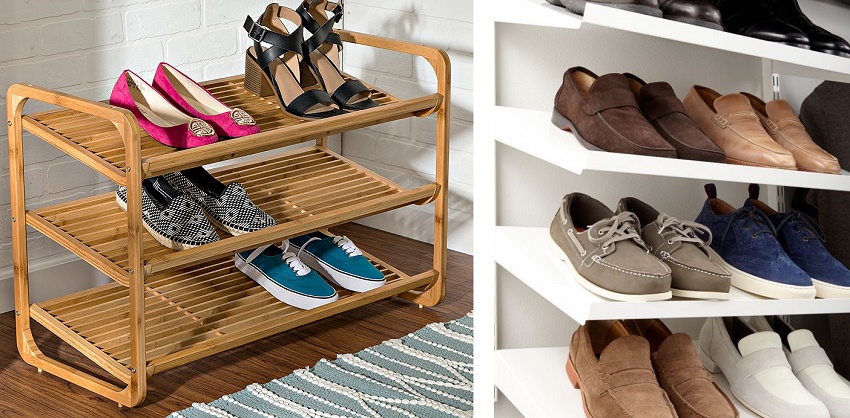
This screenshot has height=418, width=850. In order to click on shelve panels in this screenshot , I will do `click(705, 41)`, `click(638, 163)`, `click(620, 316)`, `click(545, 382)`, `click(204, 314)`, `click(106, 246)`, `click(93, 153)`.